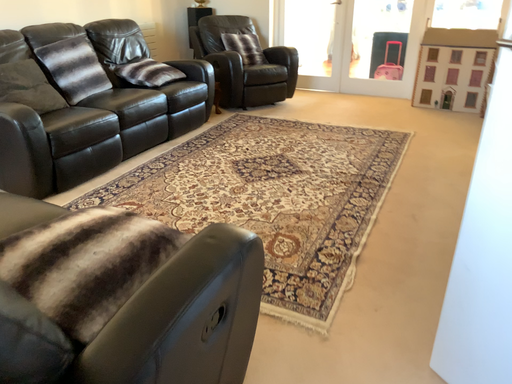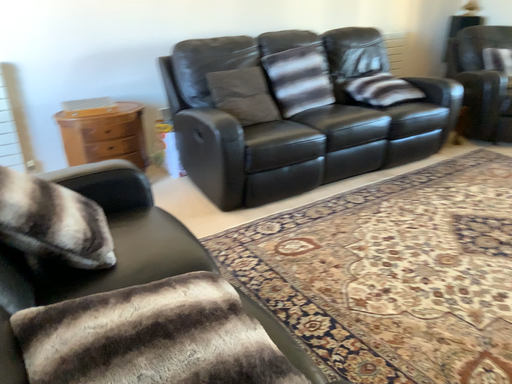
Question: Which way did the camera rotate in the video?

Choices:
 (A) rotated left
 (B) rotated right

Answer: (A)